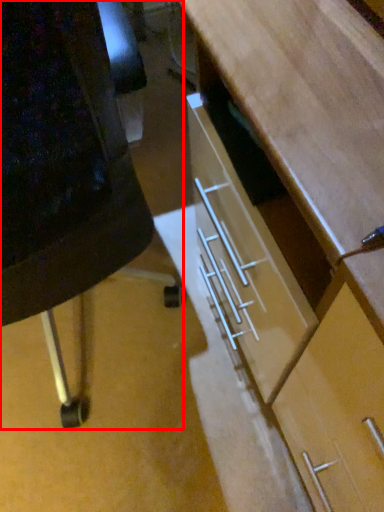
Question: In this image, where is furniture (annotated by the red box) located relative to desk?

Choices:
 (A) left
 (B) right

Answer: (A)